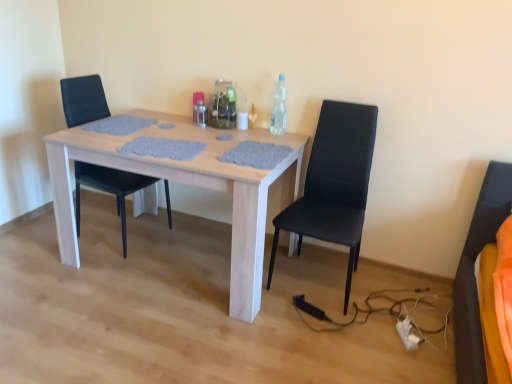
What are the coordinates of `vacant area that lies to the right of white fabric extension cord at lower right` in the screenshot? It's located at (436, 339).